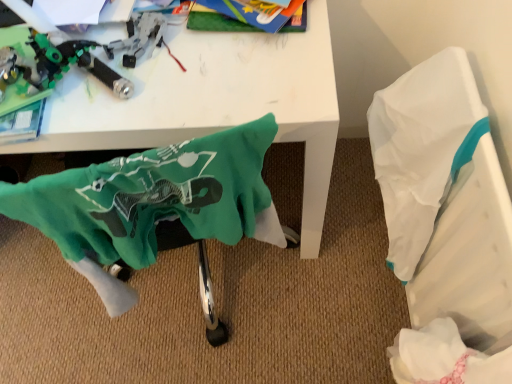
What are the coordinates of `vacant space in white paper at right (from a real-world perspective)` in the screenshot? It's located at (372, 241).